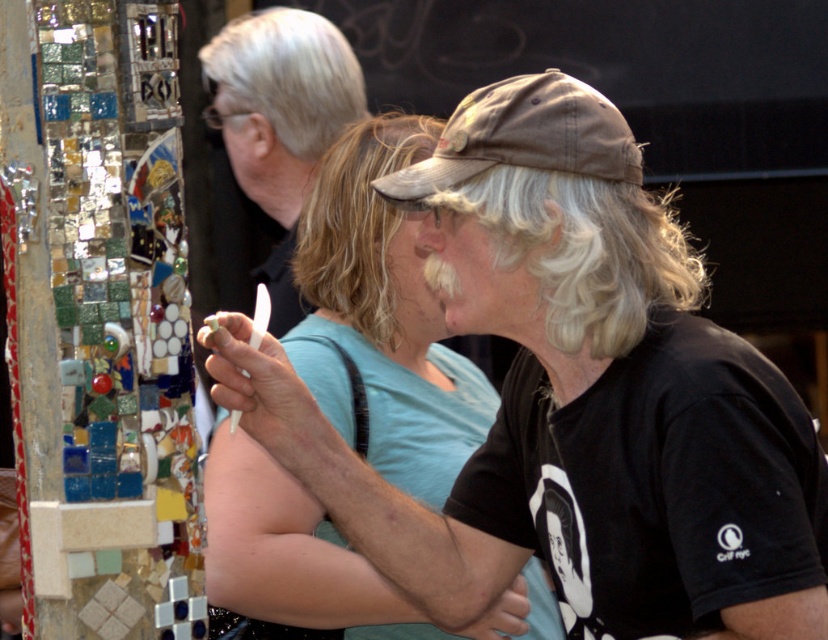
Question: Does light blue cotton shirt at center appear on the right side of tan fabric baseball cap at center?

Choices:
 (A) no
 (B) yes

Answer: (A)

Question: Based on their relative distances, which object is farther from the white matte cap at upper center?

Choices:
 (A) light blue cotton shirt at center
 (B) tan fabric baseball cap at center

Answer: (B)

Question: Which point is farther to the camera?

Choices:
 (A) light blue cotton shirt at center
 (B) tan fabric baseball cap at center

Answer: (A)

Question: Can you confirm if light blue cotton shirt at center is smaller than white matte cap at upper center?

Choices:
 (A) yes
 (B) no

Answer: (B)

Question: Which of the following is the farthest from the observer?

Choices:
 (A) tan fabric baseball cap at center
 (B) light blue cotton shirt at center
 (C) white matte cap at upper center

Answer: (C)

Question: Does light blue cotton shirt at center appear under white matte cap at upper center?

Choices:
 (A) yes
 (B) no

Answer: (A)